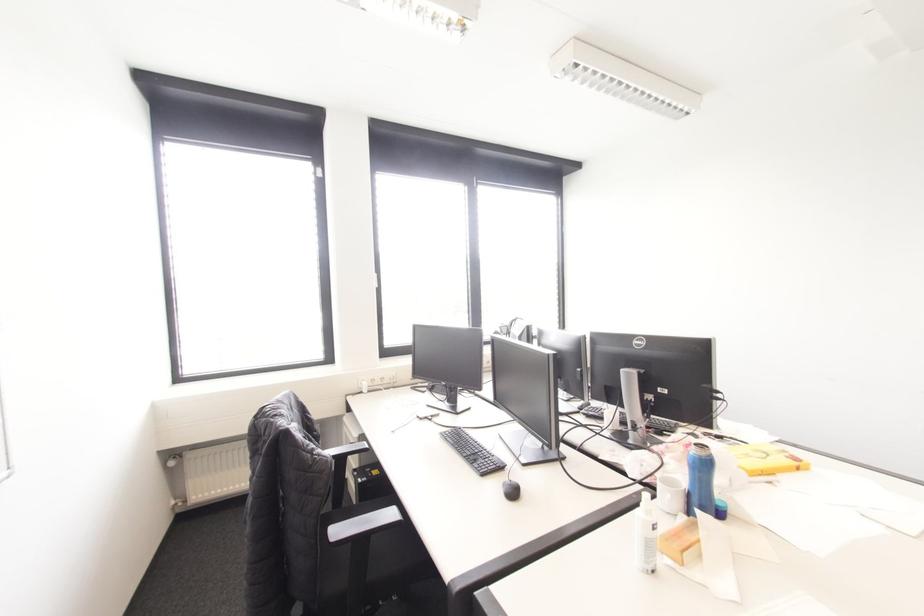
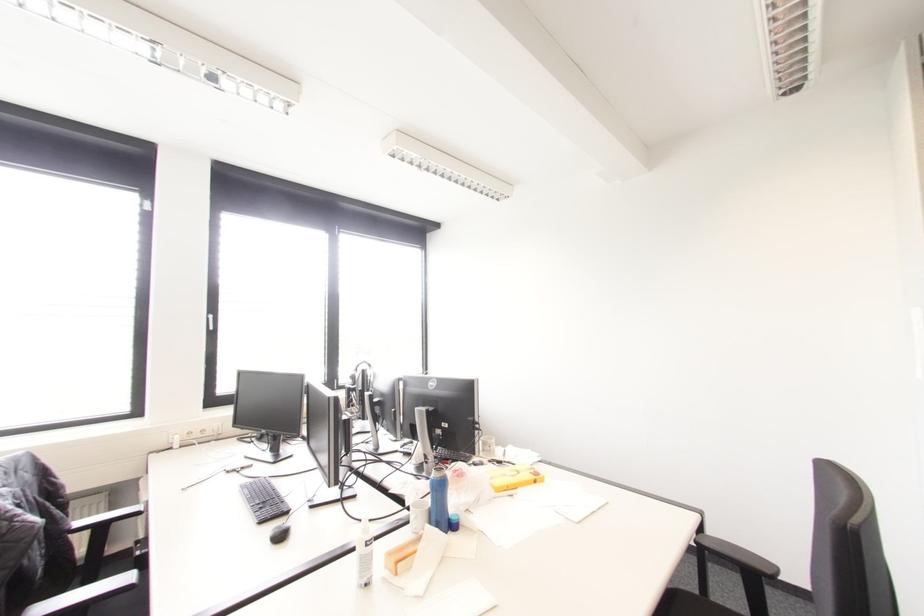
Question: I am providing you with two images of the same scene from different viewpoints. After the viewpoint changes to image2, which objects are now occluded?

Choices:
 (A) white mug handle
 (B) white glue stick
 (C) black headphones
 (D) none of these

Answer: (D)